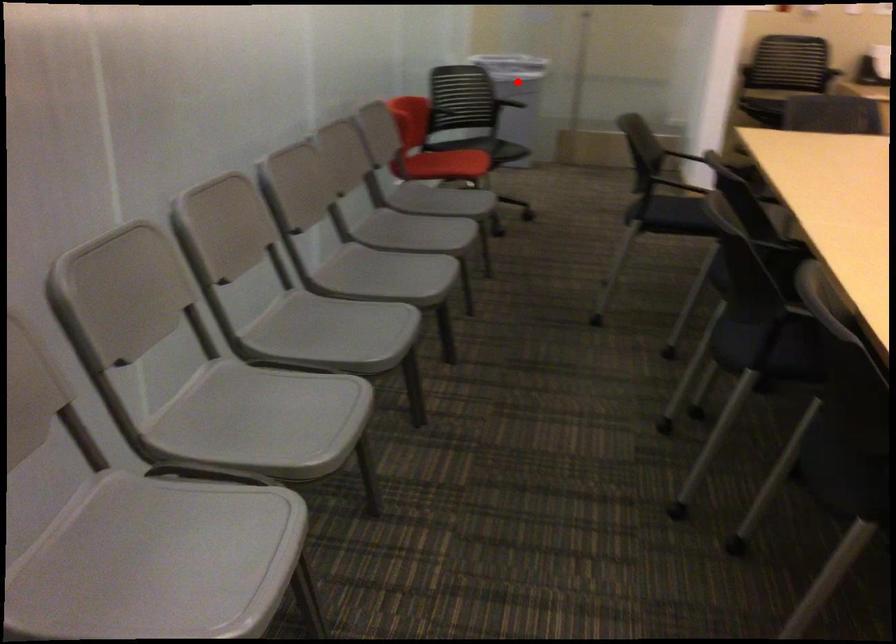
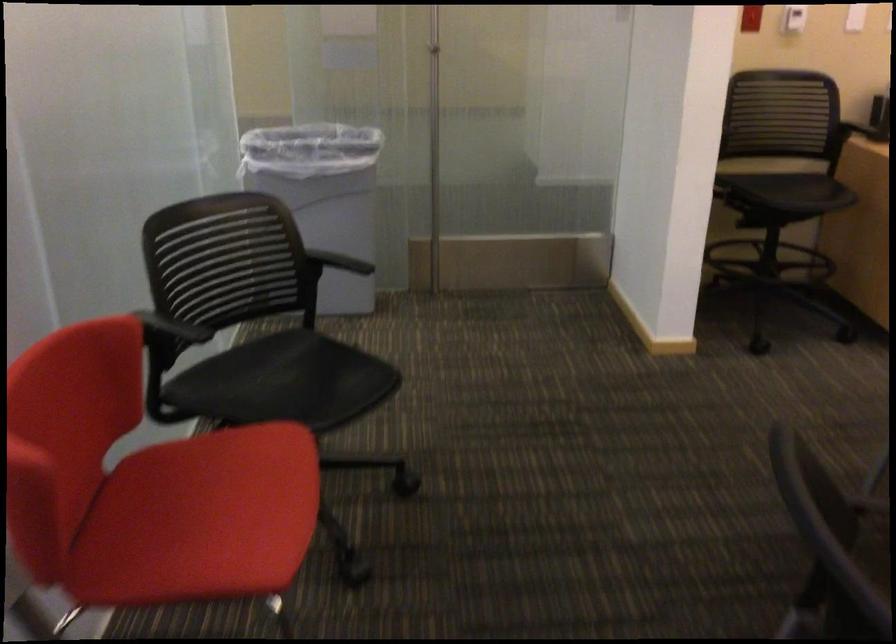
Question: I am providing you with two images of the same scene from different viewpoints. A red point is marked on the first image. Is the red point's position out of view in image 2?

Choices:
 (A) Yes
 (B) No

Answer: (B)